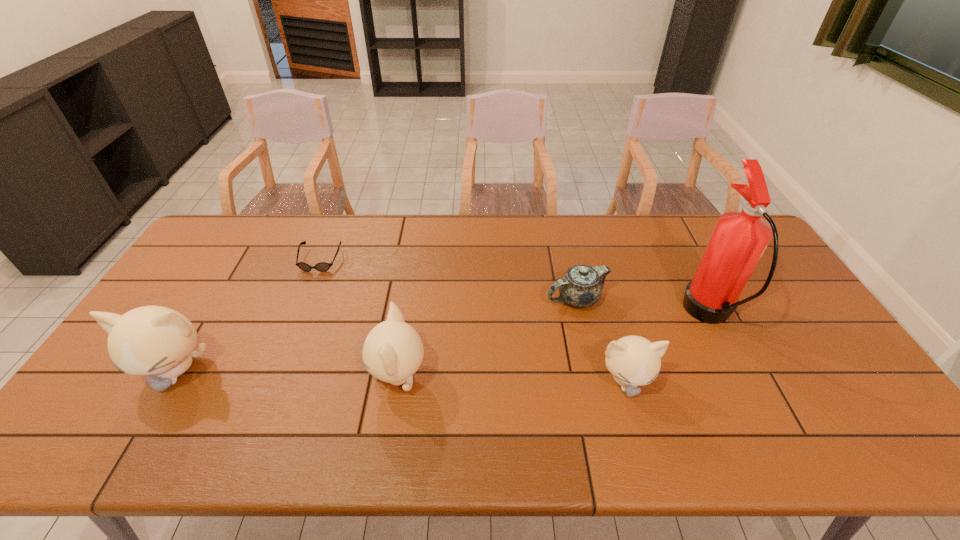
You are a GUI agent. You are given a task and a screenshot of the screen. Output one action in this format:
    pyautogui.click(x=<x>, y=<y>)
    Task: Click on the object present at the far edge
    
    Given the screenshot: What is the action you would take?
    pyautogui.click(x=321, y=266)

I want to click on object that is at the left edge, so click(151, 340).

This screenshot has height=540, width=960. I want to click on object positioned at the near left corner, so click(x=151, y=340).

Identify the location of vacant space at the far edge of the desktop. This screenshot has height=540, width=960. (613, 254).

Find the location of a particular element. The height and width of the screenshot is (540, 960). vacant space at the near edge of the desktop is located at coordinates (467, 406).

Where is `free region at the left edge`? Image resolution: width=960 pixels, height=540 pixels. free region at the left edge is located at coordinates (202, 275).

Where is `vacant region at the right edge of the desktop`? vacant region at the right edge of the desktop is located at coordinates (778, 302).

Identify the location of vacant space at the far left corner of the desktop. (241, 220).

Locate an element on the screen. blank region between the rightmost object and the second shortest object is located at coordinates (643, 307).

Identify the location of free space between the shortest kitten and the third tallest object. The height and width of the screenshot is (540, 960). (512, 379).